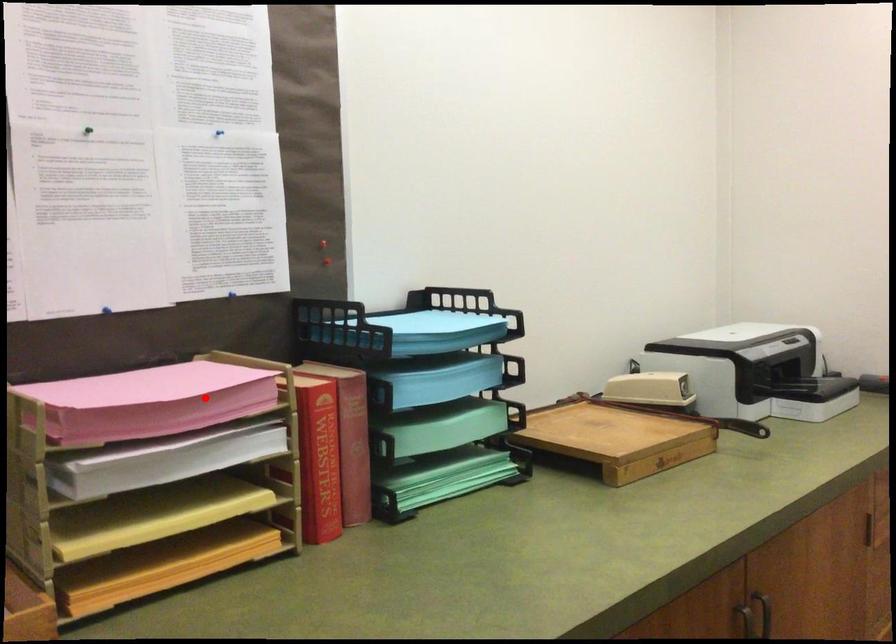
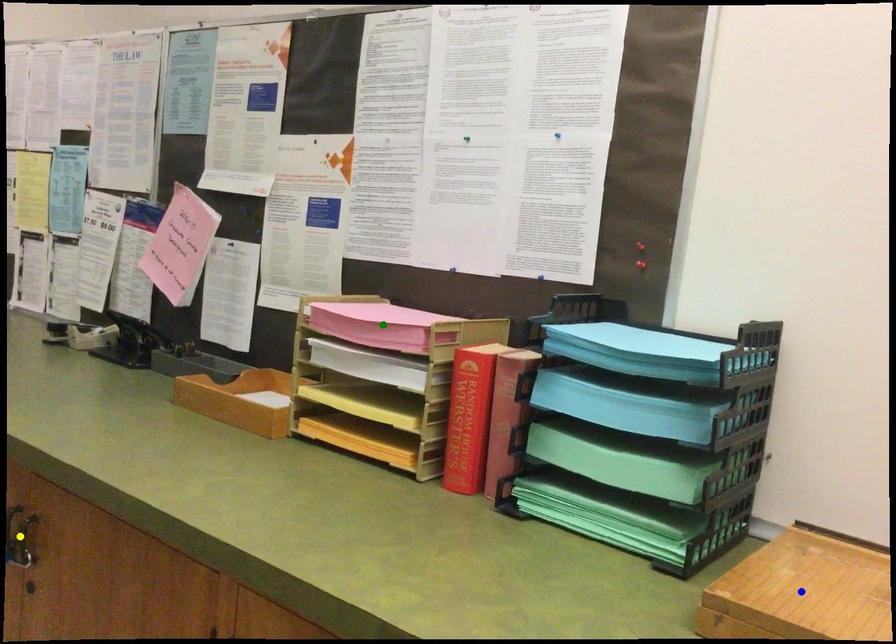
Question: I am providing you with two images of the same scene from different viewpoints. A red point is marked on the first image. You are given multiple points on the second image. Can you choose the point in image 2 that corresponds to the point in image 1?

Choices:
 (A) blue point
 (B) green point
 (C) yellow point

Answer: (B)